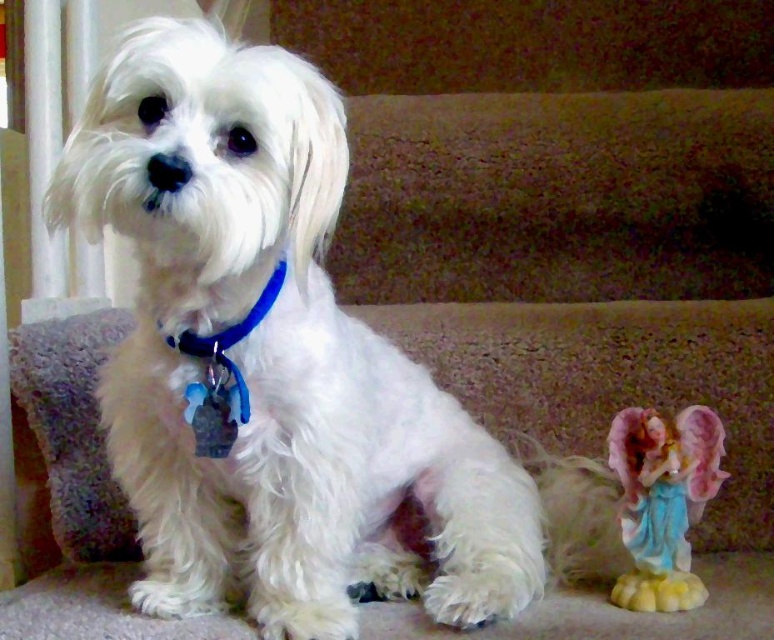
You are a delivery robot that needs to place a small gift box between the white fluffy dog at center and the porcelain angel at lower right. The gift box is 12 inches long. Will there be enough space between them to fit the gift box?

The white fluffy dog at center and the porcelain angel at lower right are 13.14 inches apart from each other. Since the gift box is 12 inches long, there is enough space between them to fit the gift box.

You are standing in front of the couch and want to place a small toy for the dog. The toy can be placed at either point A or point B. Point A is at coordinates point (279, 396) and point B is at coordinates point (680, 547). Which point is closer to you so the dog can easily reach it?

Point (279, 396) is closer to the viewer than point (680, 547), so placing the toy there would make it easier for the dog to reach.